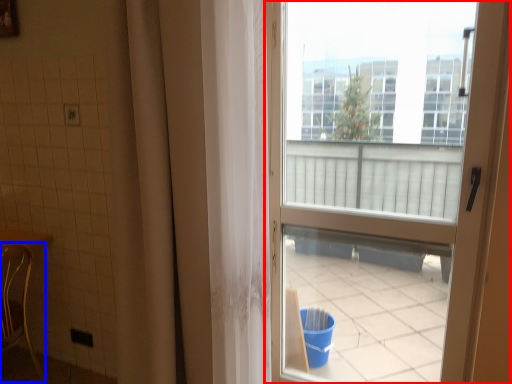
Question: Which of the following is the closest to the observer, door (highlighted by a red box) or chair (highlighted by a blue box)?

Choices:
 (A) door
 (B) chair

Answer: (A)